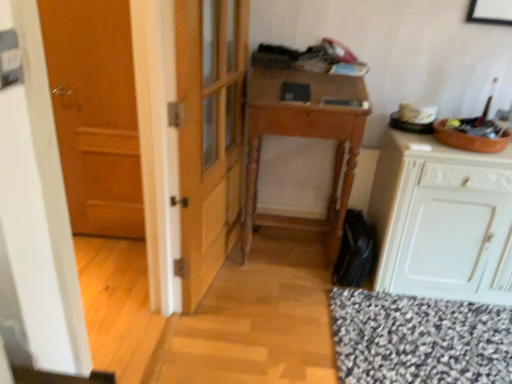
Identify the location of vacant region in front of wooden desk at center. This screenshot has height=384, width=512. (295, 308).